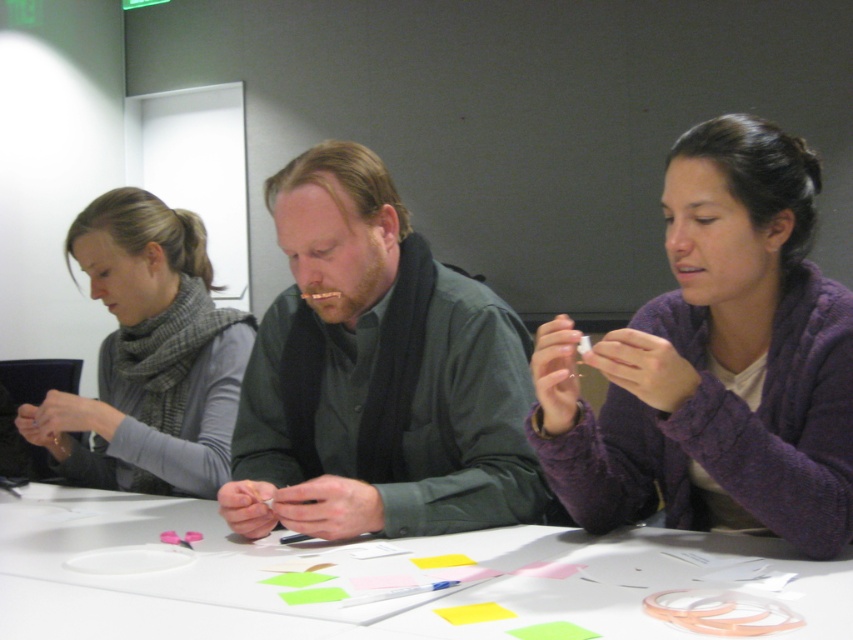
You are organizing a craft workshop and need to ensure that all materials are accessible. The purple fuzzy sweater at center and the white paper at center are both on the table. Which object is taller and might block the view of the other?

The purple fuzzy sweater at center is taller than the white paper at center, so it might block the view of the white paper at center.

You are organizing a meeting and need to place a name tag on the table so it is visible to everyone. Considering the white paper at center and the gray wool scarf at left, where should you place the name tag to ensure it is above both objects?

The name tag should be placed above the gray wool scarf at left since the white paper at center is located below it, making the scarf the higher object.